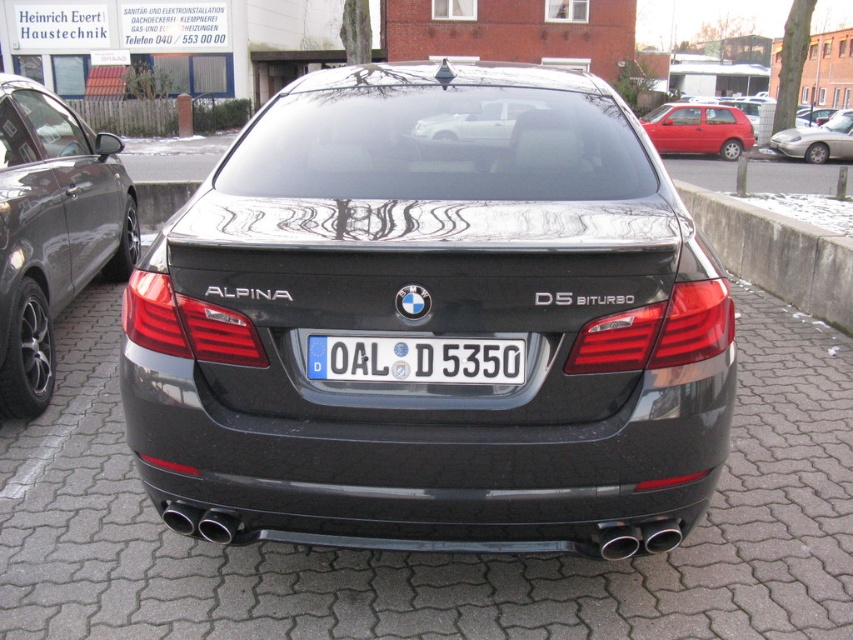
Question: Does concrete at right appear on the left side of silver metallic sports car at right?

Choices:
 (A) yes
 (B) no

Answer: (A)

Question: Which object is closer to the camera taking this photo?

Choices:
 (A) matte black sedan at left
 (B) glossy black sedan at center
 (C) silver metallic sports car at right
 (D) metallic red hatchback at upper right

Answer: (B)

Question: Does matte black sedan at left have a smaller size compared to concrete at right?

Choices:
 (A) no
 (B) yes

Answer: (A)

Question: Which is farther from the metallic red hatchback at upper right?

Choices:
 (A) silver metallic sports car at right
 (B) glossy black sedan at center
 (C) matte black sedan at left

Answer: (B)

Question: Is glossy black sedan at center above matte black sedan at left?

Choices:
 (A) no
 (B) yes

Answer: (A)

Question: Which of the following is the farthest from the observer?

Choices:
 (A) silver metallic sports car at right
 (B) matte black sedan at left
 (C) metallic red hatchback at upper right

Answer: (A)